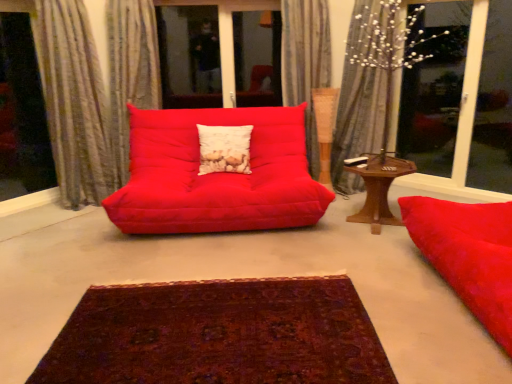
Locate an element on the screen. The width and height of the screenshot is (512, 384). free space between matte red studio couch at right, which is the second studio couch in left-to-right order, and deep burgundy woven rug at center is located at coordinates tap(362, 280).